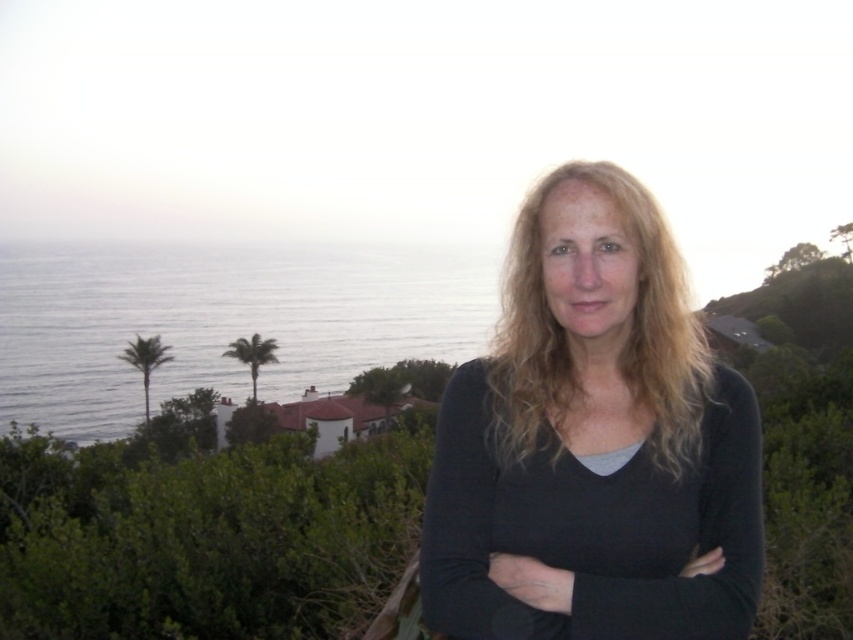
Consider the image. Is black matte arm at center further to the viewer compared to blonde wavy hair at center?

No, it is not.

Which of these two, black matte arm at center or blonde wavy hair at center, stands taller?

blonde wavy hair at center is taller.

Locate an element on the screen. This screenshot has width=853, height=640. black matte arm at center is located at coordinates (634, 534).

Consider the image. Does blue water at left come behind black matte arm at center?

Yes.

Does blue water at left have a greater height compared to black matte arm at center?

Correct, blue water at left is much taller as black matte arm at center.

What do you see at coordinates (223, 321) in the screenshot? I see `blue water at left` at bounding box center [223, 321].

Where is `blue water at left`? The image size is (853, 640). blue water at left is located at coordinates (223, 321).

Find the location of `black matte shirt at center`. black matte shirt at center is located at coordinates (595, 440).

Between black matte shirt at center and blue water at left, which one has less height?

Standing shorter between the two is black matte shirt at center.

Does point (670, 301) come behind point (368, 337)?

No, it is not.

Locate an element on the screen. This screenshot has width=853, height=640. black matte shirt at center is located at coordinates (595, 440).